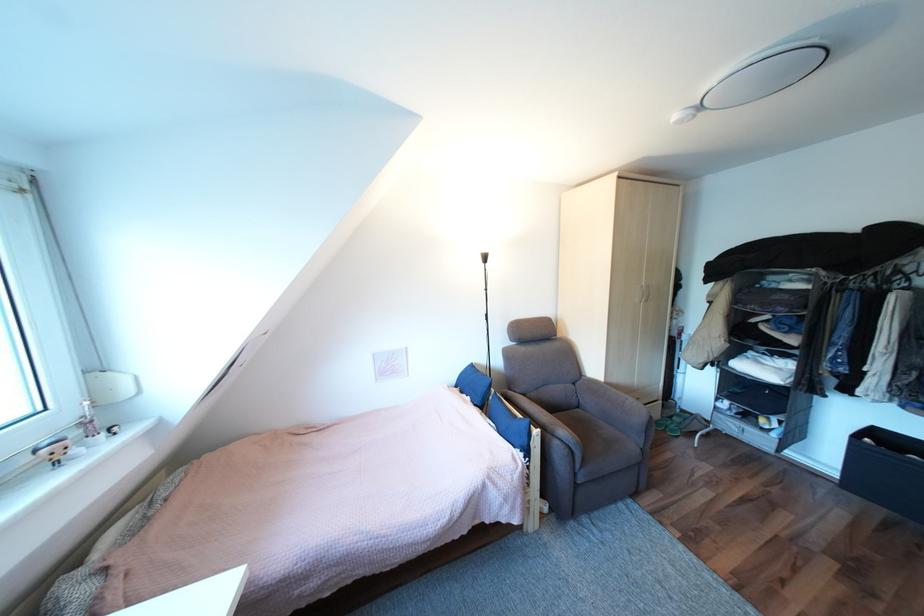
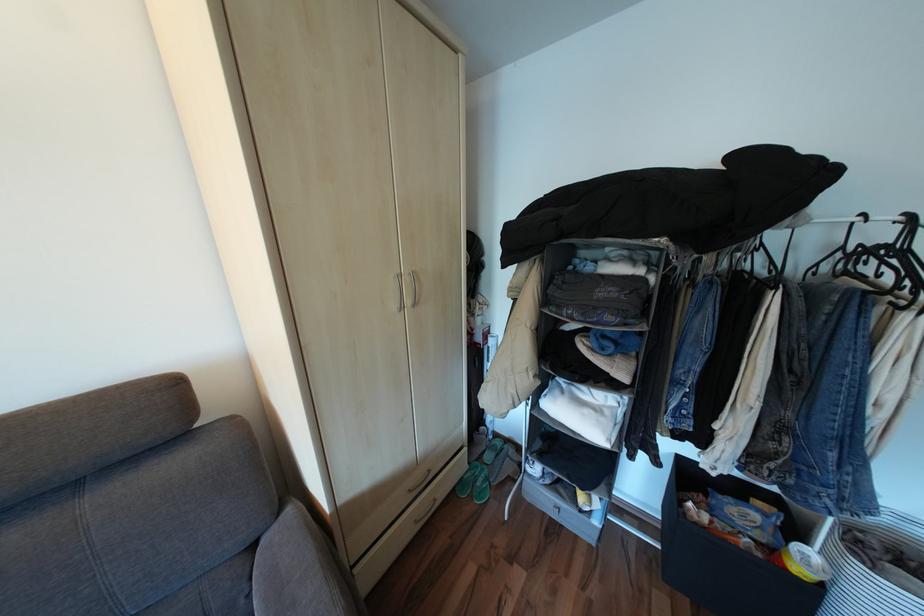
Find the pixel in the second image that matches point 675,431 in the first image.

(481, 496)